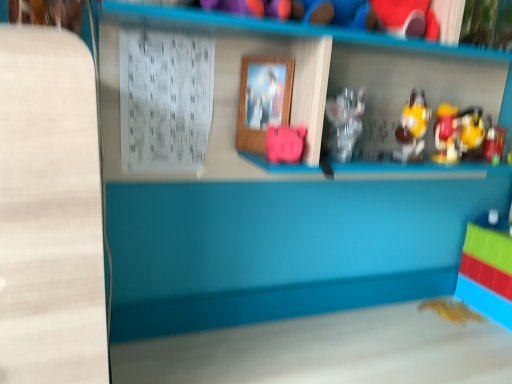
Question: Is wooden picture frame at center looking in the opposite direction of gold metallic bat at lower right, marked as the 1th toy in a bottom-to-top arrangement?

Choices:
 (A) no
 (B) yes

Answer: (A)

Question: From a real-world perspective, is wooden picture frame at center physically below gold metallic bat at lower right, marked as the 1th toy in a bottom-to-top arrangement?

Choices:
 (A) yes
 (B) no

Answer: (B)

Question: Is wooden picture frame at center beside gold metallic bat at lower right, which appears as the sixth toy when viewed from the top?

Choices:
 (A) yes
 (B) no

Answer: (B)

Question: Does wooden picture frame at center have a smaller size compared to gold metallic bat at lower right, which is the 3th toy in right-to-left order?

Choices:
 (A) yes
 (B) no

Answer: (B)

Question: Considering the relative positions of wooden picture frame at center and gold metallic bat at lower right, marked as the 1th toy in a bottom-to-top arrangement, in the image provided, is wooden picture frame at center to the left of gold metallic bat at lower right, marked as the 1th toy in a bottom-to-top arrangement, from the viewer's perspective?

Choices:
 (A) no
 (B) yes

Answer: (B)

Question: Is gold metallic bat at lower right, marked as the 1th toy in a bottom-to-top arrangement, inside the boundaries of metallic gold toy at right, positioned as the fifth toy in left-to-right order, or outside?

Choices:
 (A) outside
 (B) inside

Answer: (A)

Question: Is gold metallic bat at lower right, which is the 3th toy in right-to-left order, wider or thinner than metallic gold toy at right, acting as the second toy starting from the right?

Choices:
 (A) wide
 (B) thin

Answer: (A)

Question: From a real-world perspective, relative to metallic gold toy at right, the third toy when ordered from top to bottom, is gold metallic bat at lower right, which appears as the sixth toy when viewed from the top, vertically above or below?

Choices:
 (A) above
 (B) below

Answer: (B)

Question: Considering their positions, is gold metallic bat at lower right, which is the 3th toy in right-to-left order, located in front of or behind metallic gold toy at right, marked as the 4th toy in a bottom-to-top arrangement?

Choices:
 (A) behind
 (B) front

Answer: (A)

Question: From a real-world perspective, is translucent plastic toy at lower right, the fifth toy from the top, above or below metallic gold toy at right, acting as the second toy starting from the right?

Choices:
 (A) below
 (B) above

Answer: (A)

Question: Is translucent plastic toy at lower right, the second toy when ordered from bottom to top, wider or thinner than metallic gold toy at right, marked as the 4th toy in a bottom-to-top arrangement?

Choices:
 (A) wide
 (B) thin

Answer: (A)

Question: From the image's perspective, is translucent plastic toy at lower right, positioned as the sixth toy in left-to-right order, above or below metallic gold toy at right, marked as the 4th toy in a bottom-to-top arrangement?

Choices:
 (A) above
 (B) below

Answer: (B)

Question: Does point (510, 279) appear closer or farther from the camera than point (487, 130)?

Choices:
 (A) closer
 (B) farther

Answer: (B)

Question: In the image, is yellow plastic toy at upper right, which is the fourth toy from right to left, on the left side or the right side of metallic gold toy at right, the third toy when ordered from top to bottom?

Choices:
 (A) left
 (B) right

Answer: (A)

Question: From a real-world perspective, is yellow plastic toy at upper right, which is the 2th toy from top to bottom, above or below metallic gold toy at right, the third toy when ordered from top to bottom?

Choices:
 (A) above
 (B) below

Answer: (A)